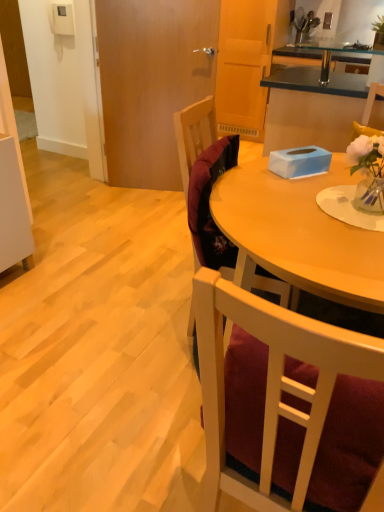
Question: Is the position of velvet burgundy chair at center, the second chair viewed from the back, less distant than that of blue matte tissue box at center?

Choices:
 (A) yes
 (B) no

Answer: (A)

Question: Is there a large distance between velvet burgundy chair at center, the 1th chair when ordered from front to back, and blue matte tissue box at center?

Choices:
 (A) yes
 (B) no

Answer: (A)

Question: From a real-world perspective, is velvet burgundy chair at center, the second chair viewed from the back, located beneath blue matte tissue box at center?

Choices:
 (A) no
 (B) yes

Answer: (B)

Question: Is velvet burgundy chair at center, the second chair viewed from the back, to the left of blue matte tissue box at center from the viewer's perspective?

Choices:
 (A) no
 (B) yes

Answer: (B)

Question: From a real-world perspective, is velvet burgundy chair at center, the second chair viewed from the back, over blue matte tissue box at center?

Choices:
 (A) no
 (B) yes

Answer: (A)

Question: Looking at the image, does velvet burgundy chair at center, the second chair viewed from the back, seem bigger or smaller compared to velvet burgundy chair at center, which ranks as the 1th chair in back-to-front order?

Choices:
 (A) big
 (B) small

Answer: (A)

Question: Is point (350, 349) positioned closer to the camera than point (180, 129)?

Choices:
 (A) closer
 (B) farther

Answer: (A)

Question: From their relative heights in the image, would you say velvet burgundy chair at center, the second chair viewed from the back, is taller or shorter than velvet burgundy chair at center, which ranks as the 1th chair in back-to-front order?

Choices:
 (A) tall
 (B) short

Answer: (A)

Question: Is velvet burgundy chair at center, the second chair viewed from the back, in front of or behind velvet burgundy chair at center, the 2th chair when ordered from front to back, in the image?

Choices:
 (A) behind
 (B) front

Answer: (B)

Question: Relative to velvet burgundy chair at center, the second chair viewed from the back, is velvet burgundy chair at center, which ranks as the 1th chair in back-to-front order, in front or behind?

Choices:
 (A) front
 (B) behind

Answer: (B)

Question: Is velvet burgundy chair at center, the 2th chair when ordered from front to back, taller or shorter than velvet burgundy chair at center, the 1th chair when ordered from front to back?

Choices:
 (A) short
 (B) tall

Answer: (A)

Question: From a real-world perspective, is velvet burgundy chair at center, the 2th chair when ordered from front to back, positioned above or below velvet burgundy chair at center, the second chair viewed from the back?

Choices:
 (A) above
 (B) below

Answer: (A)

Question: Is velvet burgundy chair at center, the 2th chair when ordered from front to back, inside or outside of velvet burgundy chair at center, the 1th chair when ordered from front to back?

Choices:
 (A) inside
 (B) outside

Answer: (B)

Question: From a real-world perspective, is blue matte tissue box at center positioned above or below velvet burgundy chair at center, which ranks as the 1th chair in back-to-front order?

Choices:
 (A) above
 (B) below

Answer: (A)

Question: In terms of width, does blue matte tissue box at center look wider or thinner when compared to velvet burgundy chair at center, which ranks as the 1th chair in back-to-front order?

Choices:
 (A) wide
 (B) thin

Answer: (A)